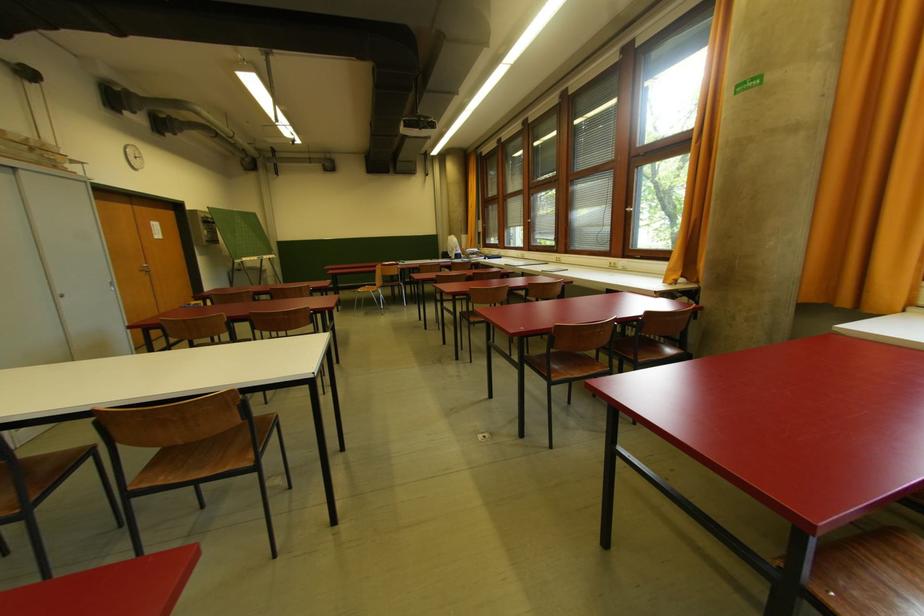
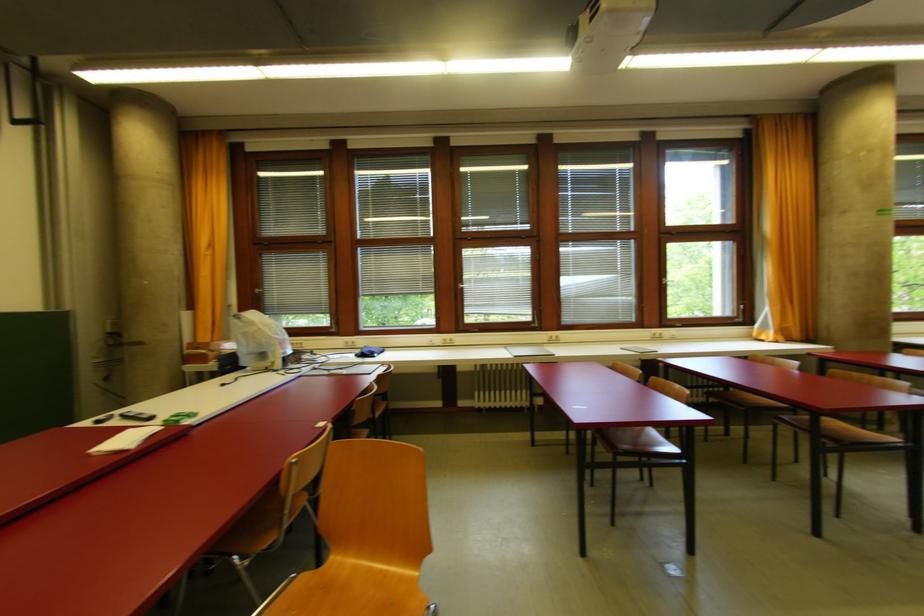
In the second image, find the point that corresponds to [614,267] in the first image.

(660, 338)